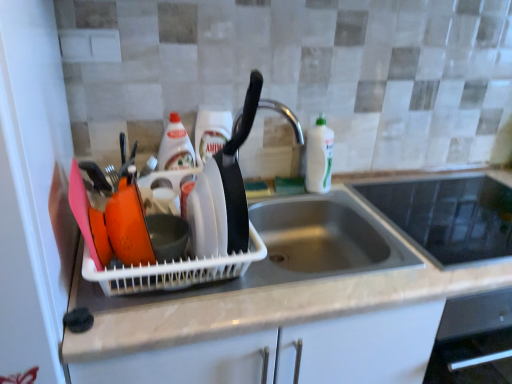
Question: In terms of height, does black glass cooktop at upper right look taller or shorter compared to translucent plastic bottle at center, positioned as the third bottle in right-to-left order?

Choices:
 (A) short
 (B) tall

Answer: (A)

Question: Is black glass cooktop at upper right inside or outside of translucent plastic bottle at center, marked as the 1th bottle in a left-to-right arrangement?

Choices:
 (A) inside
 (B) outside

Answer: (B)

Question: Estimate the real-world distances between objects in this image. Which object is farther from the white matte countertop at center?

Choices:
 (A) black glass cooktop at upper right
 (B) translucent plastic bottle at center, marked as the 1th bottle in a left-to-right arrangement
 (C) white glossy bottle at center, the second bottle in the left-to-right sequence
 (D) white glossy bottle at sink right, the third bottle positioned from the left

Answer: (B)

Question: Which object is positioned closest to the white matte countertop at center?

Choices:
 (A) white glossy bottle at sink right, which is the 1th bottle from right to left
 (B) white glossy bottle at center, the second bottle in the left-to-right sequence
 (C) translucent plastic bottle at center, marked as the 1th bottle in a left-to-right arrangement
 (D) black glass cooktop at upper right

Answer: (D)